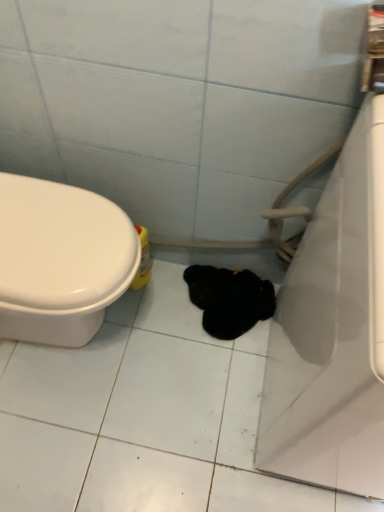
What do you see at coordinates (333, 331) in the screenshot? The width and height of the screenshot is (384, 512). I see `white glossy bathtub at right` at bounding box center [333, 331].

Where is `white glossy bathtub at right`? The image size is (384, 512). white glossy bathtub at right is located at coordinates (333, 331).

What do you see at coordinates (143, 260) in the screenshot? I see `yellow plastic bottle at lower left` at bounding box center [143, 260].

What are the coordinates of `black fuzzy animal at center` in the screenshot? It's located at (229, 298).

Where is `white glossy bathtub at right`? white glossy bathtub at right is located at coordinates (333, 331).

Between white glossy bathtub at right and black fuzzy animal at center, which one has more height?

white glossy bathtub at right is taller.

Does white glossy bathtub at right appear on the left side of black fuzzy animal at center?

No, white glossy bathtub at right is not to the left of black fuzzy animal at center.

I want to click on animal that is above the white glossy bathtub at right (from the image's perspective), so click(x=229, y=298).

From a real-world perspective, does white glossy bathtub at right stand above black fuzzy animal at center?

Yes, from a real-world perspective, white glossy bathtub at right is above black fuzzy animal at center.

Considering the sizes of objects black fuzzy animal at center and white glossy bathtub at right in the image provided, who is thinner, black fuzzy animal at center or white glossy bathtub at right?

Thinner between the two is black fuzzy animal at center.

From the image's perspective, is black fuzzy animal at center located above or below white glossy bathtub at right?

black fuzzy animal at center is situated higher than white glossy bathtub at right in the image.

Is black fuzzy animal at center bigger or smaller than white glossy bathtub at right?

In the image, black fuzzy animal at center appears to be smaller than white glossy bathtub at right.

From the image's perspective, is yellow plastic bottle at lower left positioned above or below black fuzzy animal at center?

yellow plastic bottle at lower left is above black fuzzy animal at center.

You are a GUI agent. You are given a task and a screenshot of the screen. Output one action in this format:
    pyautogui.click(x=<x>, y=<y>)
    Task: Click on the animal below the yellow plastic bottle at lower left (from the image's perspective)
    
    Given the screenshot: What is the action you would take?
    pyautogui.click(x=229, y=298)

Based on the photo, is yellow plastic bottle at lower left closer to camera compared to black fuzzy animal at center?

Yes.

How different are the orientations of yellow plastic bottle at lower left and white glossy bathtub at right in degrees?

92.4 degrees.

Locate an element on the screen. bath that is in front of the yellow plastic bottle at lower left is located at coordinates (333, 331).

From the picture: Considering the relative sizes of yellow plastic bottle at lower left and white glossy bathtub at right in the image provided, is yellow plastic bottle at lower left taller than white glossy bathtub at right?

Incorrect, the height of yellow plastic bottle at lower left is not larger of that of white glossy bathtub at right.

From a real-world perspective, is black fuzzy animal at center positioned above or below yellow plastic bottle at lower left?

From a real-world perspective, black fuzzy animal at center is physically below yellow plastic bottle at lower left.

Between black fuzzy animal at center and yellow plastic bottle at lower left, which one has smaller width?

Thinner between the two is yellow plastic bottle at lower left.

From the image's perspective, relative to yellow plastic bottle at lower left, is black fuzzy animal at center above or below?

Based on their image positions, black fuzzy animal at center is located beneath yellow plastic bottle at lower left.

Would you say black fuzzy animal at center contains yellow plastic bottle at lower left?

No, yellow plastic bottle at lower left is not a part of black fuzzy animal at center.

Consider the image. Would you say white glossy bathtub at right is a long distance from yellow plastic bottle at lower left?

No, white glossy bathtub at right is in close proximity to yellow plastic bottle at lower left.

From a real-world perspective, between white glossy bathtub at right and yellow plastic bottle at lower left, who is vertically higher?

white glossy bathtub at right is physically above.

Is white glossy bathtub at right wider or thinner than yellow plastic bottle at lower left?

Clearly, white glossy bathtub at right has more width compared to yellow plastic bottle at lower left.

Is white glossy bathtub at right not within yellow plastic bottle at lower left?

Indeed, white glossy bathtub at right is completely outside yellow plastic bottle at lower left.

Where is `animal above the white glossy bathtub at right (from the image's perspective)`? animal above the white glossy bathtub at right (from the image's perspective) is located at coordinates (229, 298).

At what (x,y) coordinates should I click in order to perform the action: click on bath in front of the black fuzzy animal at center. Please return your answer as a coordinate pair (x, y). This screenshot has height=512, width=384. Looking at the image, I should click on (333, 331).

Based on their spatial positions, is black fuzzy animal at center or white glossy bathtub at right further from yellow plastic bottle at lower left?

white glossy bathtub at right lies further to yellow plastic bottle at lower left than the other object.

Based on their spatial positions, is black fuzzy animal at center or yellow plastic bottle at lower left closer to white glossy bathtub at right?

black fuzzy animal at center lies closer to white glossy bathtub at right than the other object.

From the picture: When comparing their distances from black fuzzy animal at center, does white glossy bathtub at right or yellow plastic bottle at lower left seem further?

white glossy bathtub at right is positioned further to the anchor black fuzzy animal at center.

From the image, which object appears to be nearer to black fuzzy animal at center, yellow plastic bottle at lower left or white glossy bathtub at right?

yellow plastic bottle at lower left.

Looking at this image, which object lies further to the anchor point white glossy bathtub at right, yellow plastic bottle at lower left or black fuzzy animal at center?

Based on the image, yellow plastic bottle at lower left appears to be further to white glossy bathtub at right.

Considering their positions, is white glossy bathtub at right positioned further to yellow plastic bottle at lower left than black fuzzy animal at center?

white glossy bathtub at right is further to yellow plastic bottle at lower left.

The width and height of the screenshot is (384, 512). I want to click on cleaning product between white glossy bathtub at right and black fuzzy animal at center from front to back, so click(x=143, y=260).